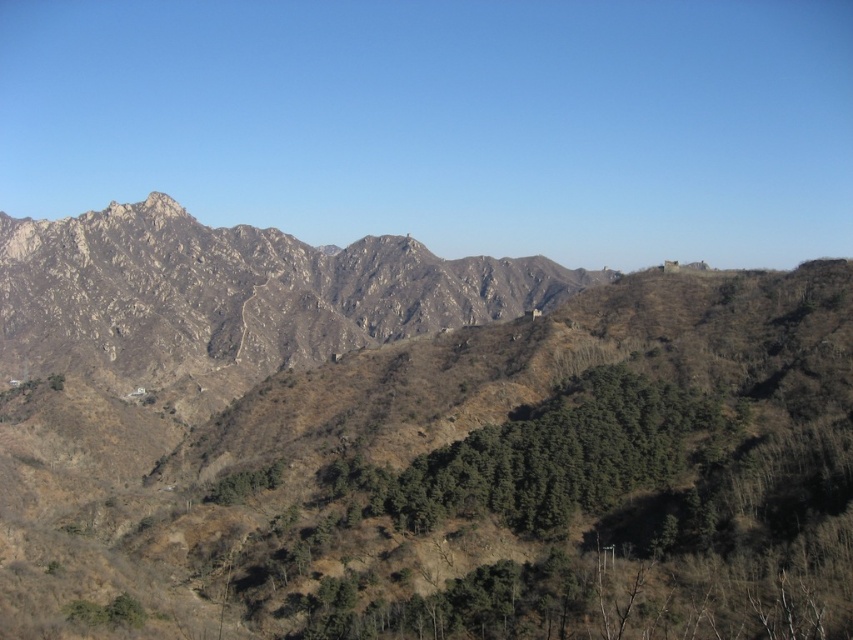
Question: Which object appears closest to the camera in this image?

Choices:
 (A) rocky brown mountain range at center
 (B) brown rocky mountain at center

Answer: (B)

Question: Does brown rocky mountain at center lie in front of rocky brown mountain range at center?

Choices:
 (A) no
 (B) yes

Answer: (B)

Question: Is brown rocky mountain at center wider than rocky brown mountain range at center?

Choices:
 (A) yes
 (B) no

Answer: (B)

Question: Which point is farther from the camera taking this photo?

Choices:
 (A) (227, 310)
 (B) (672, 442)

Answer: (A)

Question: Is brown rocky mountain at center below rocky brown mountain range at center?

Choices:
 (A) yes
 (B) no

Answer: (A)